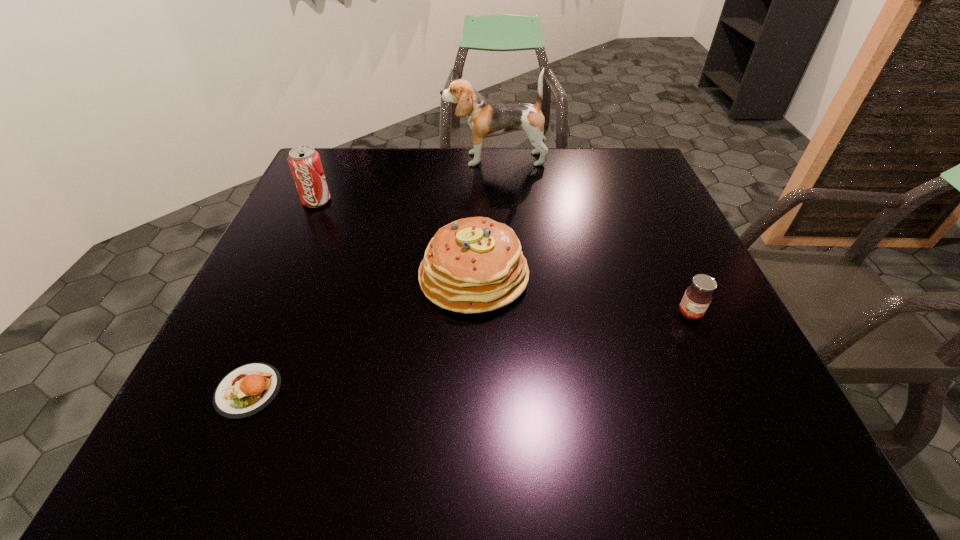
Where is `object positioned at the right edge`? Image resolution: width=960 pixels, height=540 pixels. object positioned at the right edge is located at coordinates (697, 298).

Image resolution: width=960 pixels, height=540 pixels. I want to click on object at the near left corner, so click(245, 391).

Image resolution: width=960 pixels, height=540 pixels. In order to click on blank area at the far edge in this screenshot , I will do `click(364, 186)`.

Identify the location of free region at the near edge of the desktop. (481, 438).

Where is `free space at the left edge of the desktop`? The width and height of the screenshot is (960, 540). free space at the left edge of the desktop is located at coordinates (309, 264).

Locate an element on the screen. This screenshot has height=540, width=960. vacant point at the right edge is located at coordinates [654, 334].

This screenshot has height=540, width=960. In the image, there is a desktop. What are the coordinates of `vacant space at the far right corner` in the screenshot? It's located at (627, 153).

The width and height of the screenshot is (960, 540). Identify the location of free space that is in between the shortest object and the soda can. (282, 296).

Identify the location of free space between the fourth nearest object and the patty (food). The image size is (960, 540). (282, 296).

Identify the location of empty space between the nearest object and the puppy. The height and width of the screenshot is (540, 960). (372, 275).